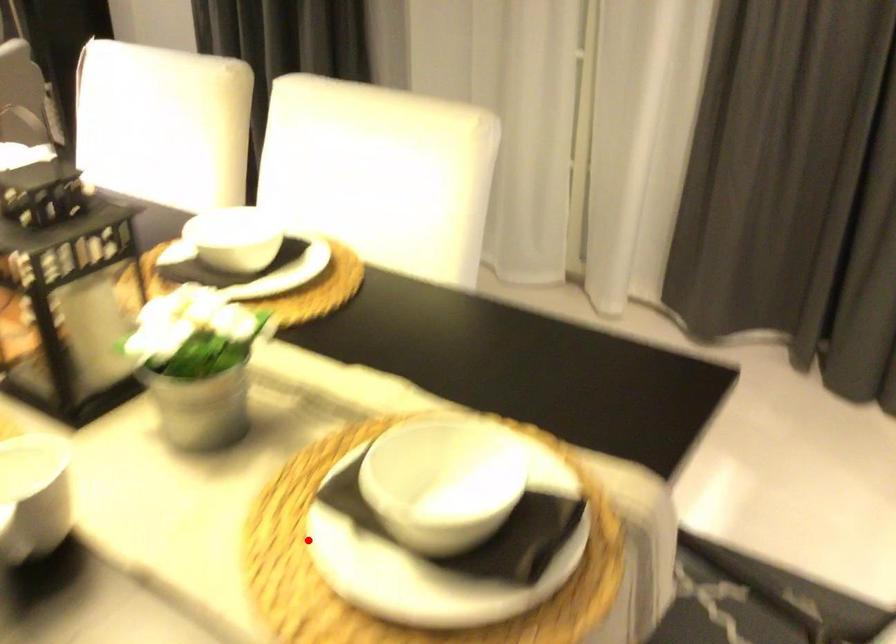
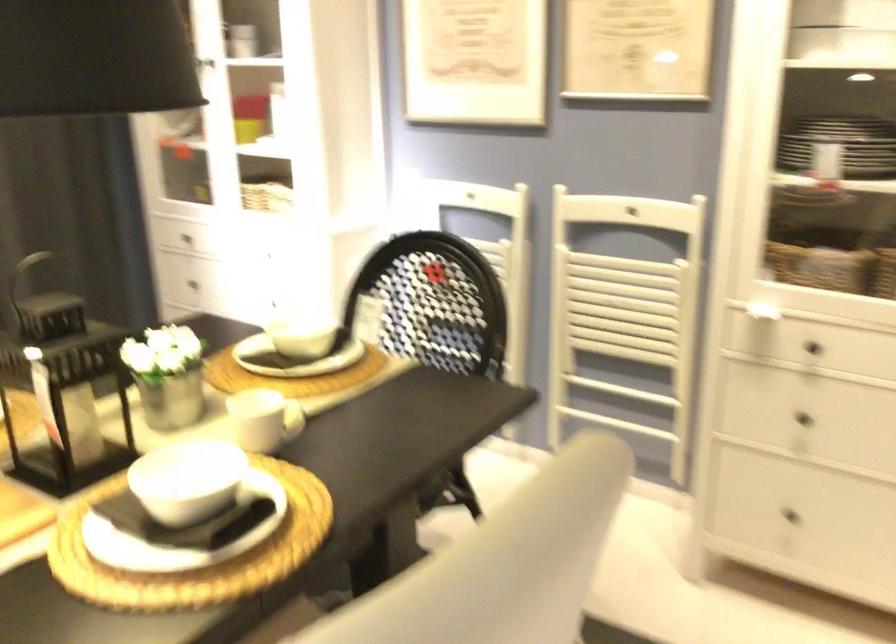
Question: I am providing you with two images of the same scene from different viewpoints. Given a red point in image1, look at the same physical point in image2. Is it:

Choices:
 (A) Closer to the viewpoint
 (B) Farther from the viewpoint

Answer: (B)